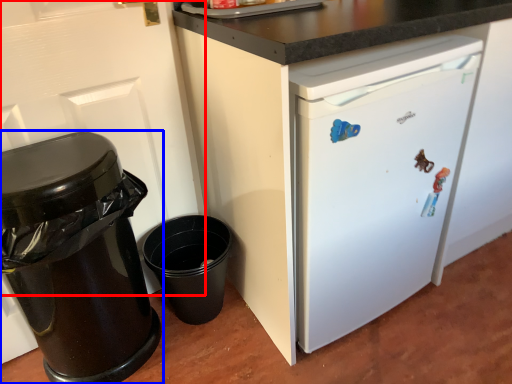
Question: Which object appears farthest to the camera in this image, door (highlighted by a red box) or waste container (highlighted by a blue box)?

Choices:
 (A) door
 (B) waste container

Answer: (B)